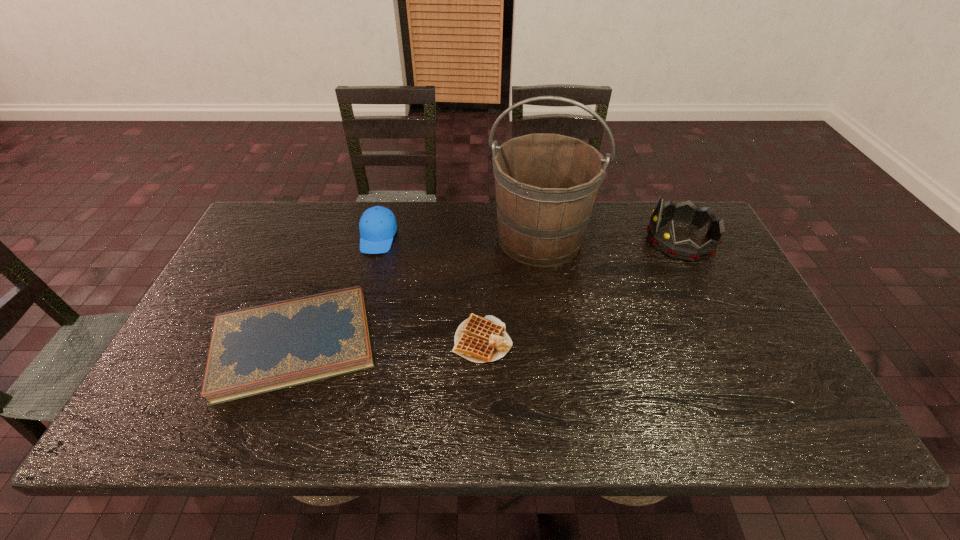
Image resolution: width=960 pixels, height=540 pixels. I want to click on object that is positioned at the far right corner, so click(x=663, y=239).

Locate an element on the screen. The height and width of the screenshot is (540, 960). vacant space at the far edge of the desktop is located at coordinates (448, 218).

Where is `vacant space at the near edge of the desktop`? This screenshot has width=960, height=540. vacant space at the near edge of the desktop is located at coordinates (263, 438).

This screenshot has height=540, width=960. In the image, there is a desktop. Find the location of `vacant space at the left edge`. vacant space at the left edge is located at coordinates (248, 279).

Locate an element on the screen. The width and height of the screenshot is (960, 540). free space at the right edge of the desktop is located at coordinates (784, 393).

This screenshot has width=960, height=540. I want to click on vacant position at the near right corner of the desktop, so point(774,431).

Locate an element on the screen. free space between the fourth shortest object and the bucket is located at coordinates (610, 239).

Where is `free space between the waffle and the paperback book`? free space between the waffle and the paperback book is located at coordinates (388, 342).

You are a GUI agent. You are given a task and a screenshot of the screen. Output one action in this format:
    pyautogui.click(x=<x>, y=<y>)
    Task: Click on the empty space between the paperback book and the waffle
    This screenshot has width=960, height=540.
    Given the screenshot: What is the action you would take?
    pyautogui.click(x=388, y=342)

Where is `free space that is in between the tiara and the bucket`? This screenshot has width=960, height=540. free space that is in between the tiara and the bucket is located at coordinates (610, 239).